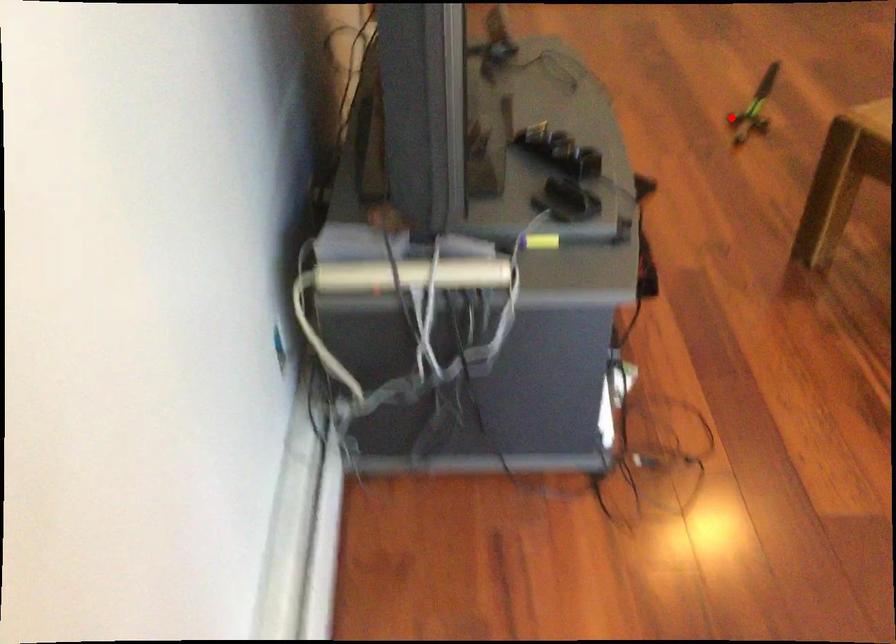
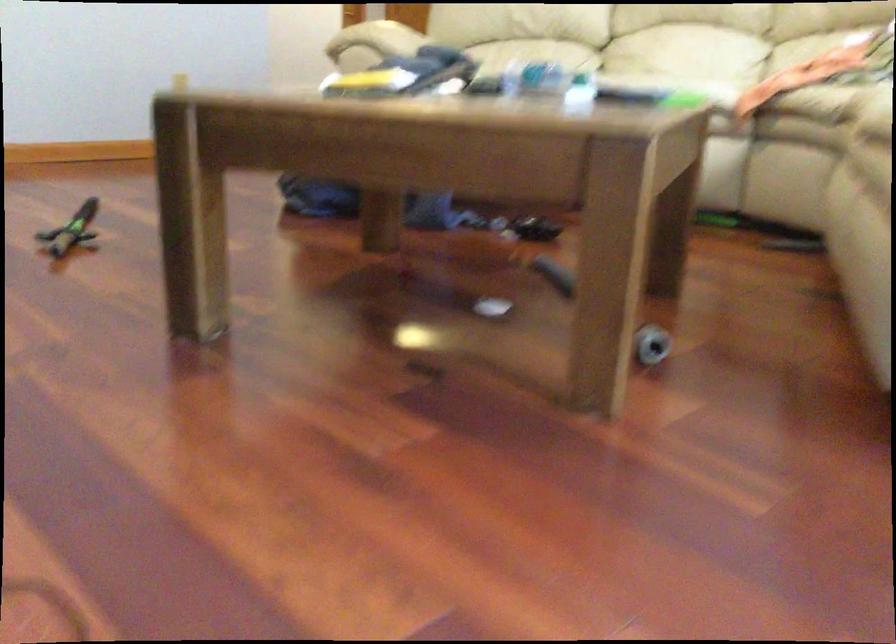
Question: A red point is marked in image1. In image2, is the corresponding 3D point closer to the camera or farther? Reply with the corresponding letter.

Choices:
 (A) The corresponding 3D point is closer.
 (B) The corresponding 3D point is farther.

Answer: (A)